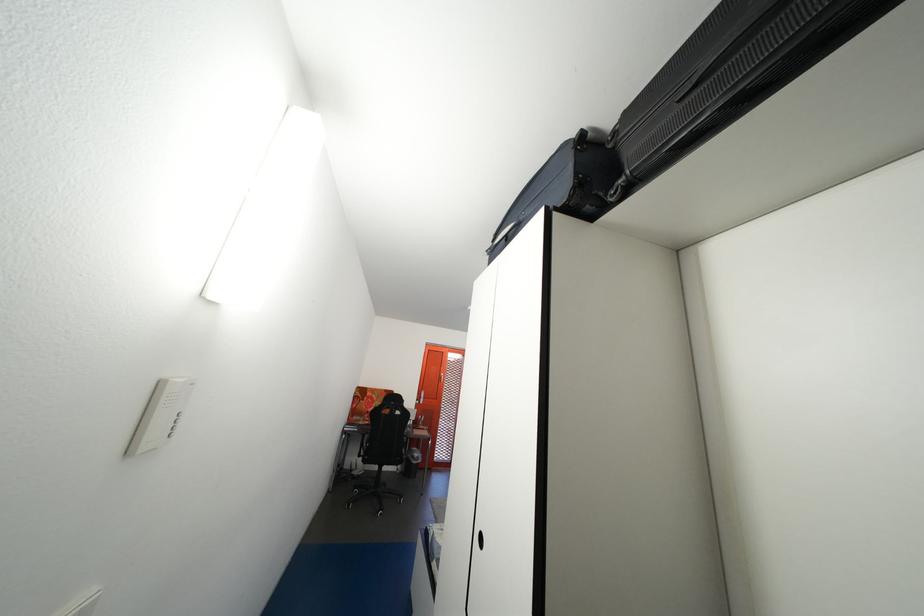
Where would you pull the black recessed handle? Please return your answer as a coordinate pair (x, y).

(487, 540)